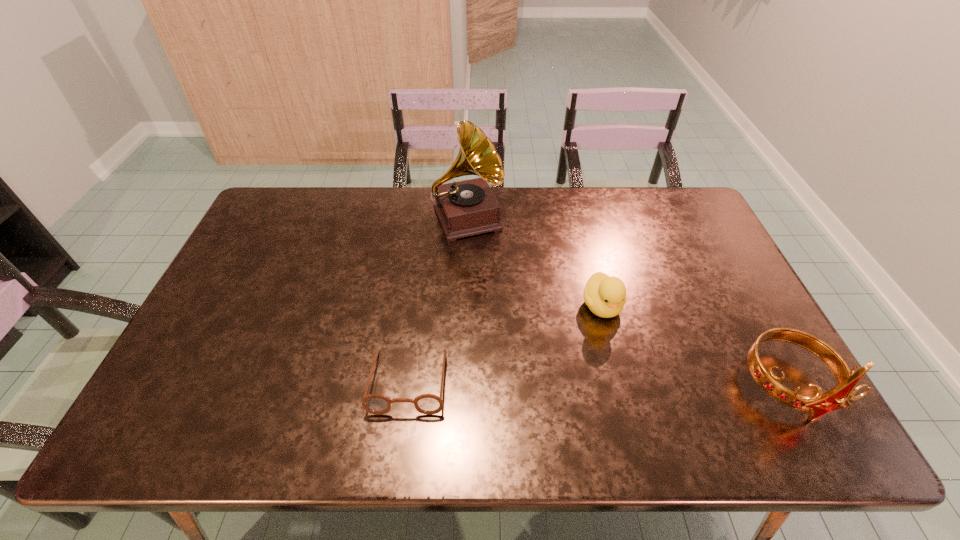
In the image, there is a desktop. In order to click on free region at the left edge in this screenshot , I will do `click(204, 315)`.

Find the location of a particular element. The image size is (960, 540). vacant space at the right edge of the desktop is located at coordinates (711, 271).

You are a GUI agent. You are given a task and a screenshot of the screen. Output one action in this format:
    pyautogui.click(x=<x>, y=<y>)
    Task: Click on the empty location between the second farthest object and the spectacles
    The height and width of the screenshot is (540, 960).
    Given the screenshot: What is the action you would take?
    pyautogui.click(x=505, y=344)

Identify the location of vacant point located between the spectacles and the duck. (505, 344).

Where is `unoccupied area between the shortest object and the second tallest object`? unoccupied area between the shortest object and the second tallest object is located at coordinates (598, 383).

At what (x,y) coordinates should I click in order to perform the action: click on empty space that is in between the third shortest object and the third nearest object. Please return your answer as a coordinate pair (x, y). Looking at the image, I should click on (695, 346).

Identify the location of free spot between the tallest object and the shortest object. (438, 300).

At what (x,y) coordinates should I click in order to perform the action: click on vacant space in between the third tallest object and the tiara. Please return your answer as a coordinate pair (x, y). The image size is (960, 540). Looking at the image, I should click on (695, 346).

Image resolution: width=960 pixels, height=540 pixels. Find the location of `empty space that is in between the spectacles and the farthest object`. empty space that is in between the spectacles and the farthest object is located at coordinates (438, 300).

The height and width of the screenshot is (540, 960). In order to click on free space between the second object from right to left and the tallest object in this screenshot , I will do `click(535, 262)`.